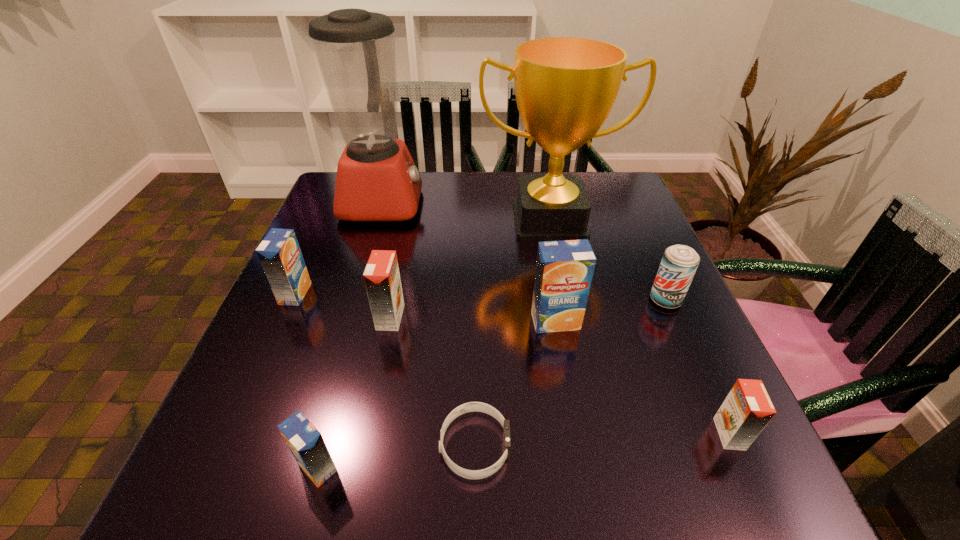
I want to click on the second blue orange_juice from right to left, so click(x=306, y=443).

Where is `the smaller orange orange juice`? the smaller orange orange juice is located at coordinates (747, 409).

At what (x,y) coordinates should I click in order to perform the action: click on the rightmost orange juice. Please return your answer as a coordinate pair (x, y). Looking at the image, I should click on (747, 409).

Where is `wristband`? The height and width of the screenshot is (540, 960). wristband is located at coordinates (471, 406).

What are the coordinates of `free space located 0.390m on the front of the blender near the controls` in the screenshot? It's located at (566, 202).

Locate an element on the screen. This screenshot has width=960, height=540. vacant point located on the front-facing side of the gold award is located at coordinates (578, 355).

Find the location of `vacant point located on the back of the second orange juice from right to left`. vacant point located on the back of the second orange juice from right to left is located at coordinates (546, 268).

Identify the location of vacant space situated 0.250m on the front of the bigger orange orange juice. Image resolution: width=960 pixels, height=540 pixels. tap(362, 456).

Locate an element on the screen. Image resolution: width=960 pixels, height=540 pixels. vacant space situated on the front of the second biggest blue orange_juice is located at coordinates (257, 380).

The width and height of the screenshot is (960, 540). What are the coordinates of `free point located on the left of the beer can` in the screenshot? It's located at (592, 300).